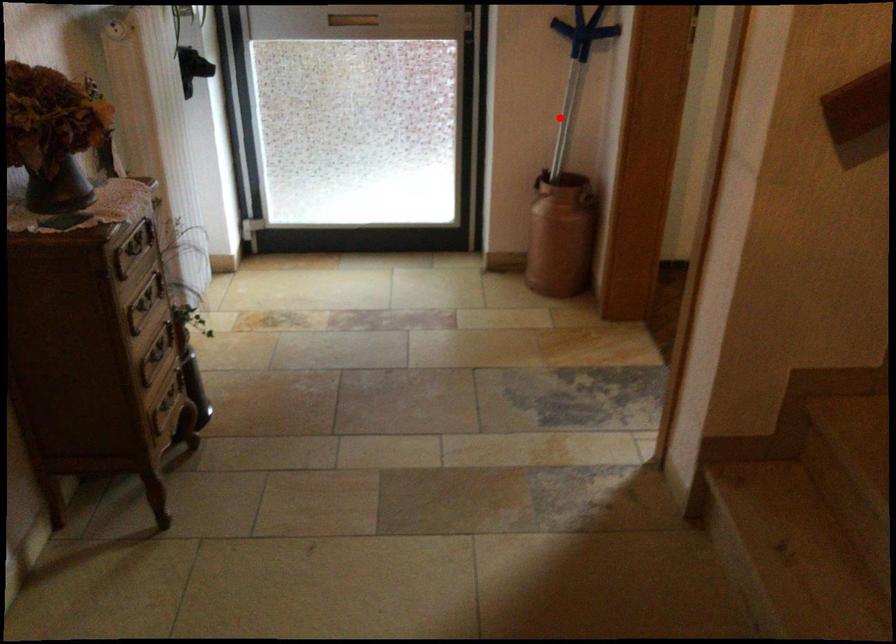
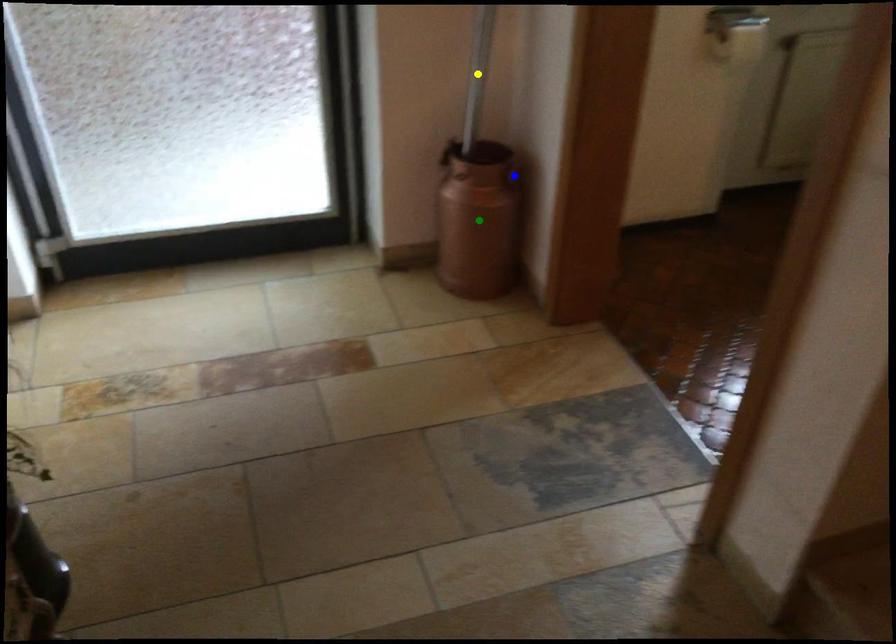
Question: I am providing you with two images of the same scene from different viewpoints. A red point is marked on the first image. You are given multiple points on the second image. Which spot in image 2 lines up with the point in image 1?

Choices:
 (A) blue point
 (B) yellow point
 (C) green point

Answer: (B)